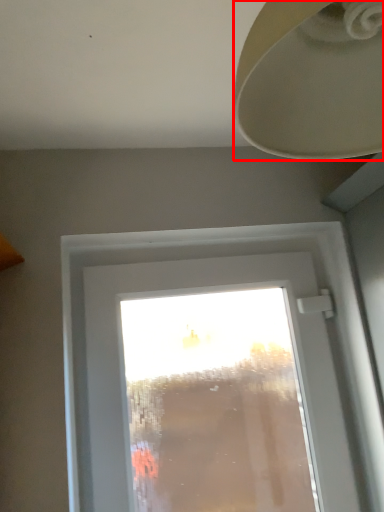
Question: Where is lamp (annotated by the red box) located in relation to window in the image?

Choices:
 (A) left
 (B) right

Answer: (B)